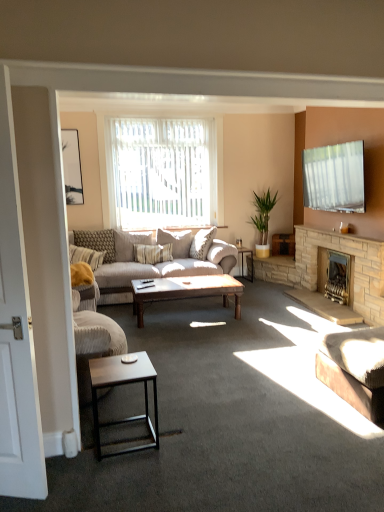
Question: From the image's perspective, is brown textured fabric studio couch at lower right, marked as the first studio couch in a right-to-left arrangement, above or below wooden coffee table at center, acting as the 2th coffee table starting from the front?

Choices:
 (A) below
 (B) above

Answer: (A)

Question: From a real-world perspective, is brown textured fabric studio couch at lower right, which is the 2th studio couch in back-to-front order, physically located above or below wooden coffee table at center, acting as the 2th coffee table starting from the front?

Choices:
 (A) above
 (B) below

Answer: (B)

Question: Which object is positioned farthest from the textured beige pillow at center, the 2th pillow viewed from the left?

Choices:
 (A) brass/bronze fireplace at lower right, placed as the second fireplace when sorted from front to back
 (B) beige fabric couch at center, which ranks as the first studio couch in back-to-front order
 (C) black wood side table at center
 (D) green leafy plant at center-right
 (E) matte black picture frame at upper left

Answer: (A)

Question: Considering the real-world distances, which object is farthest from the textured beige pillow at left, the first pillow from the left?

Choices:
 (A) white wood screen door at left
 (B) matte black picture frame at upper left
 (C) brown textured fabric studio couch at lower right, the 2th studio couch positioned from the left
 (D) white sheer curtains at center
 (E) beige fabric pillow at center, the 1th pillow in the right-to-left sequence

Answer: (C)